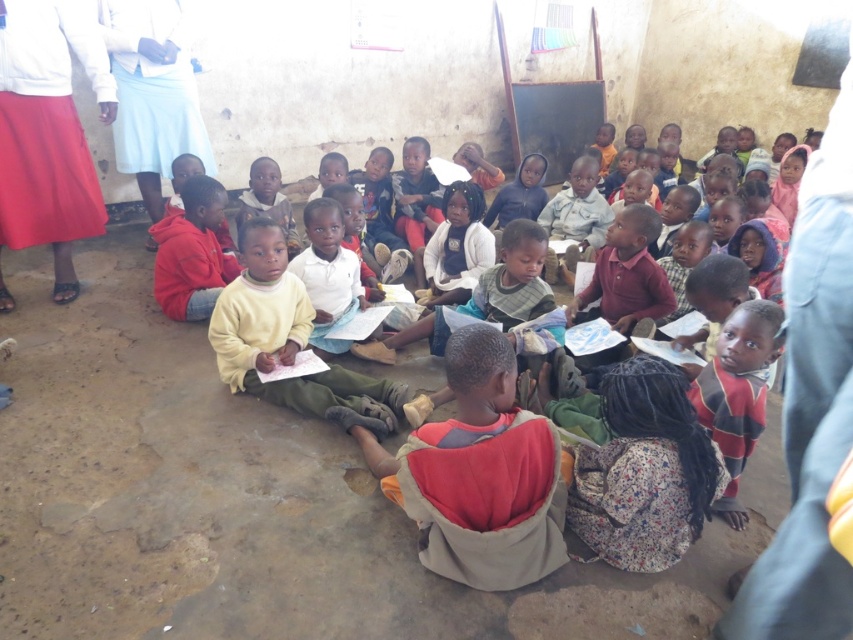
Based on the photo, you are a teacher in the classroom and want to place a rectangular box that is 1 meter wide on the floor. You have two options to place it between the blue denim jacket at upper right and the striped wool sweater at lower right. Can you fit the box horizontally between them without overlapping either?

The blue denim jacket at upper right is wider than the striped wool sweater at lower right. Since the box is 1 meter wide, you need to check the distance between them. However, the description only mentions their widths, not the space between. Therefore, it is impossible to determine if the box will fit without additional information about the distance between the two items.

You are a teacher in the classroom and you need to cover the white fabric at upper left and striped wool sweater at lower right with a single large sheet. Which object requires a bigger sheet to cover completely?

The white fabric at upper left requires a bigger sheet because it is larger in size than the striped wool sweater at lower right according to the description.

You are a teacher in the classroom. You need to hang a small poster on the wall between the blue denim jacket at upper right and the striped wool sweater at lower right. Can you fit the poster between them vertically?

The blue denim jacket at upper right is taller than the striped wool sweater at lower right, so there is vertical space between them. The poster can be placed in the available vertical space between the two items.